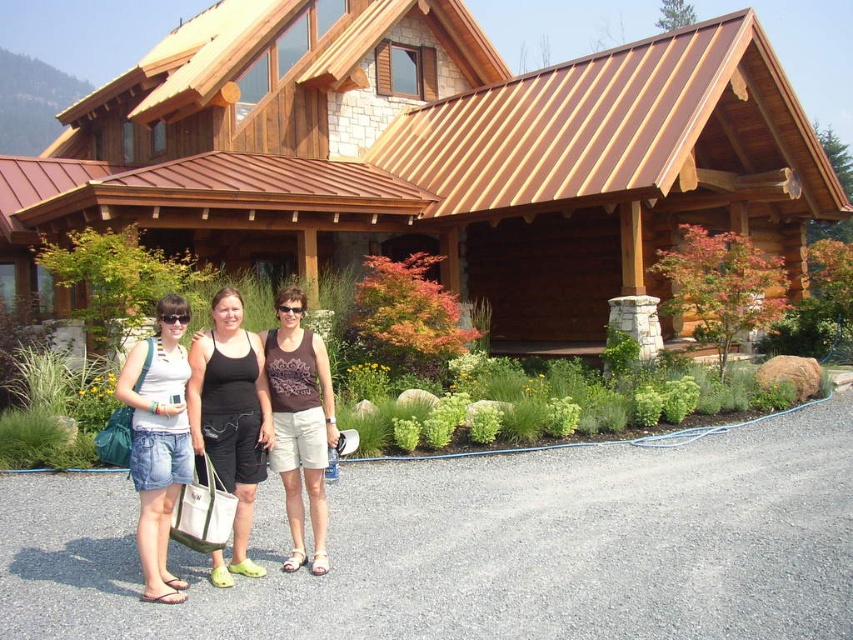
Between gray gravel driveway at lower center and black fabric shorts at center, which one appears on the right side from the viewer's perspective?

gray gravel driveway at lower center is more to the right.

Can you confirm if gray gravel driveway at lower center is positioned below black fabric shorts at center?

Correct, gray gravel driveway at lower center is located below black fabric shorts at center.

The width and height of the screenshot is (853, 640). What do you see at coordinates (483, 547) in the screenshot? I see `gray gravel driveway at lower center` at bounding box center [483, 547].

The width and height of the screenshot is (853, 640). I want to click on gray gravel driveway at lower center, so click(483, 547).

Which is more to the right, wooden cabin at center or denim shorts at center?

wooden cabin at center is more to the right.

Which is in front, point (677, 141) or point (137, 348)?

Point (137, 348)

Where is `wooden cabin at center`? wooden cabin at center is located at coordinates (434, 154).

Identify the location of wooden cabin at center. (434, 154).

Does point (245, 572) come behind point (297, 449)?

No, it is not.

Is black fabric shorts at center shorter than brown fabric tank top at center?

In fact, black fabric shorts at center may be taller than brown fabric tank top at center.

Who is more forward, (192, 424) or (305, 440)?

Positioned in front is point (192, 424).

Identify the location of black fabric shorts at center. The height and width of the screenshot is (640, 853). 230,419.